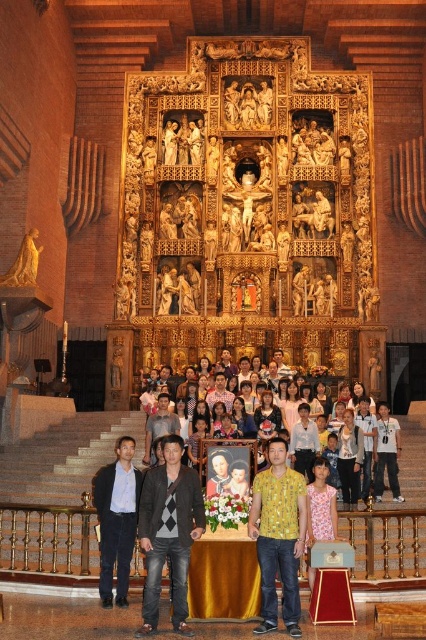
Question: Where is dark blue suit at lower left located in relation to yellow textured shirt at center in the image?

Choices:
 (A) above
 (B) below

Answer: (B)

Question: Is yellow textured shirt at center to the left of light blue shirt at center from the viewer's perspective?

Choices:
 (A) no
 (B) yes

Answer: (B)

Question: Which point is closer to the camera taking this photo?

Choices:
 (A) (176, 609)
 (B) (273, 580)
 (C) (347, 496)

Answer: (A)

Question: Which object is the farthest from the light blue shirt at center?

Choices:
 (A) yellow printed shirt at center
 (B) yellow textured shirt at center

Answer: (A)

Question: Is yellow printed shirt at center positioned in front of dark blue suit at lower left?

Choices:
 (A) no
 (B) yes

Answer: (B)

Question: Among these objects, which one is nearest to the camera?

Choices:
 (A) yellow printed shirt at center
 (B) light blue shirt at center

Answer: (A)